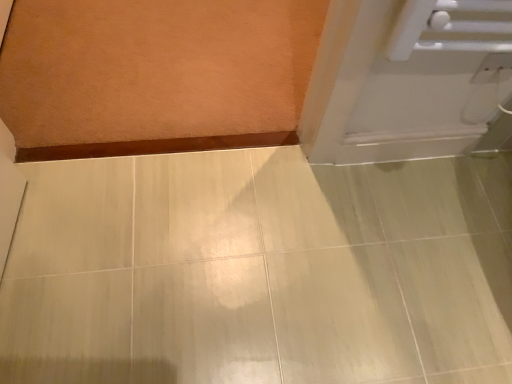
I want to click on blank space above white glossy tile at center (from a real-world perspective), so click(262, 251).